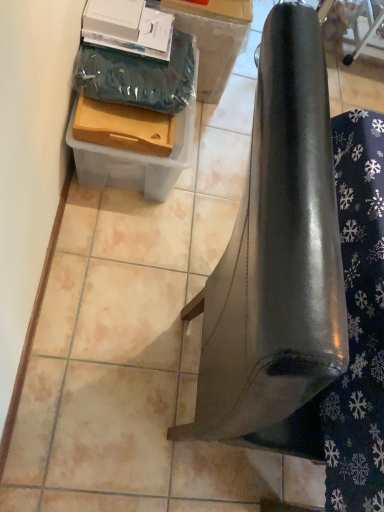
What are the coordinates of `free location to the left of glossy metallic punching bag at right` in the screenshot? It's located at (114, 293).